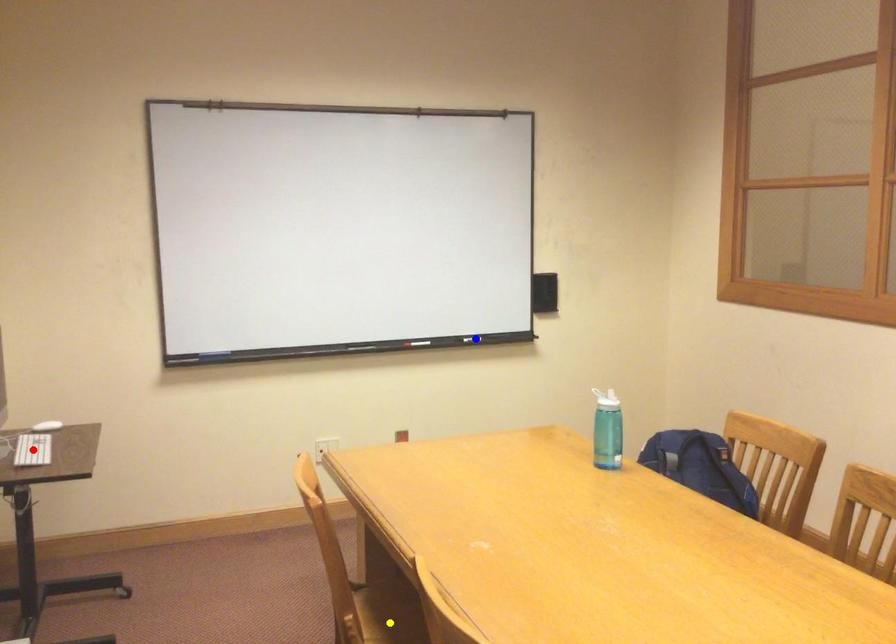
Order these from nearest to farthest:
1. yellow point
2. blue point
3. red point

blue point < red point < yellow point